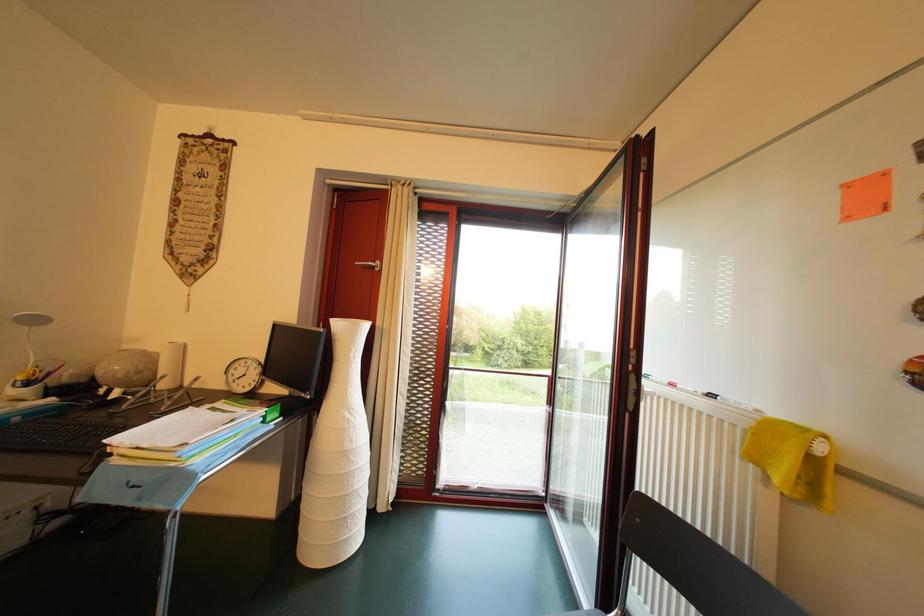
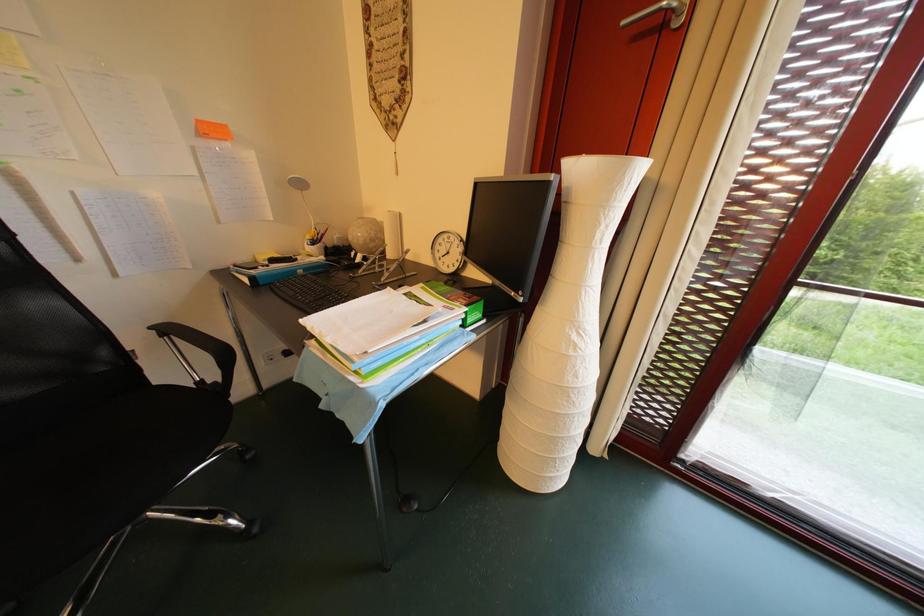
Based on the continuous images, in which direction is the camera rotating?

The camera rotated toward left-down.